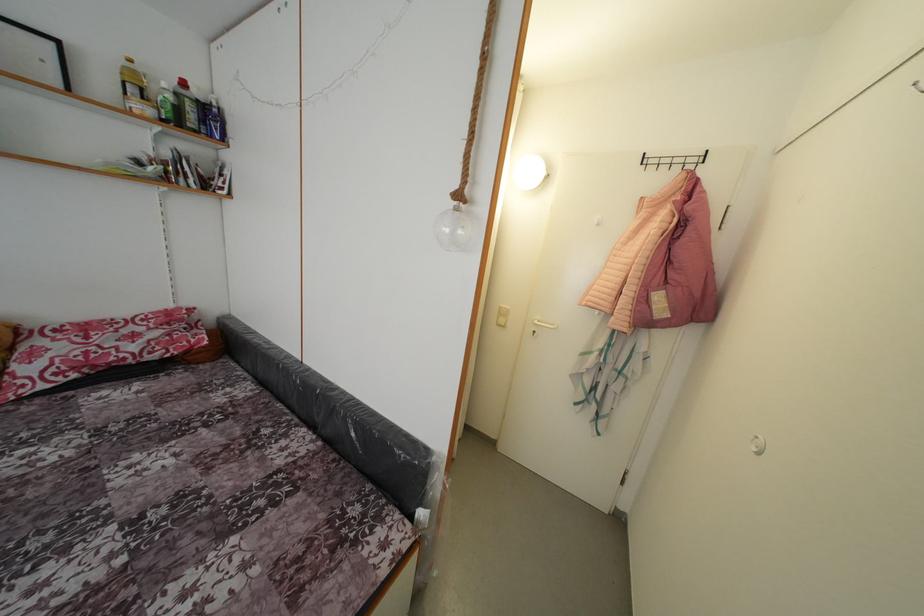
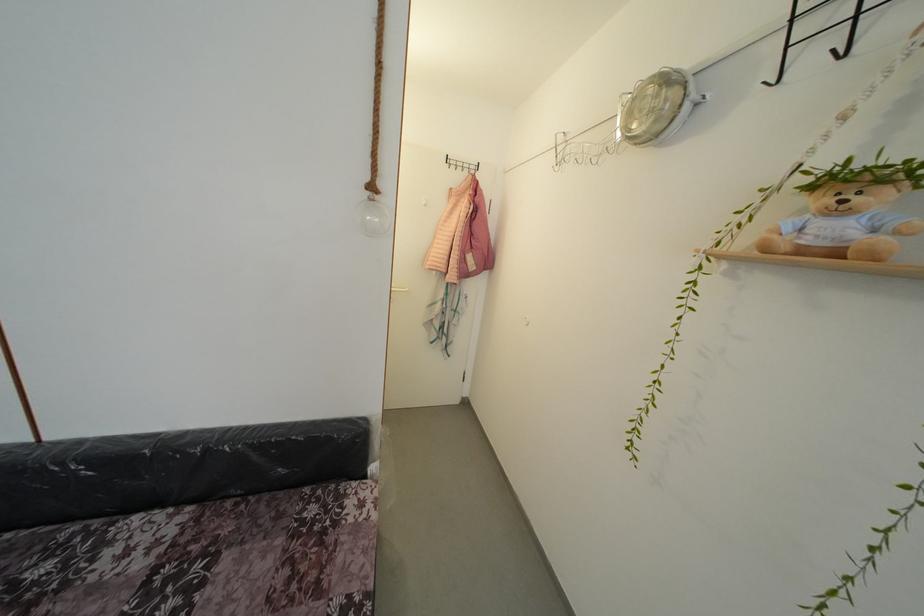
Find the pixel in the second image that matches pixel 272 458 in the first image.

(99, 585)